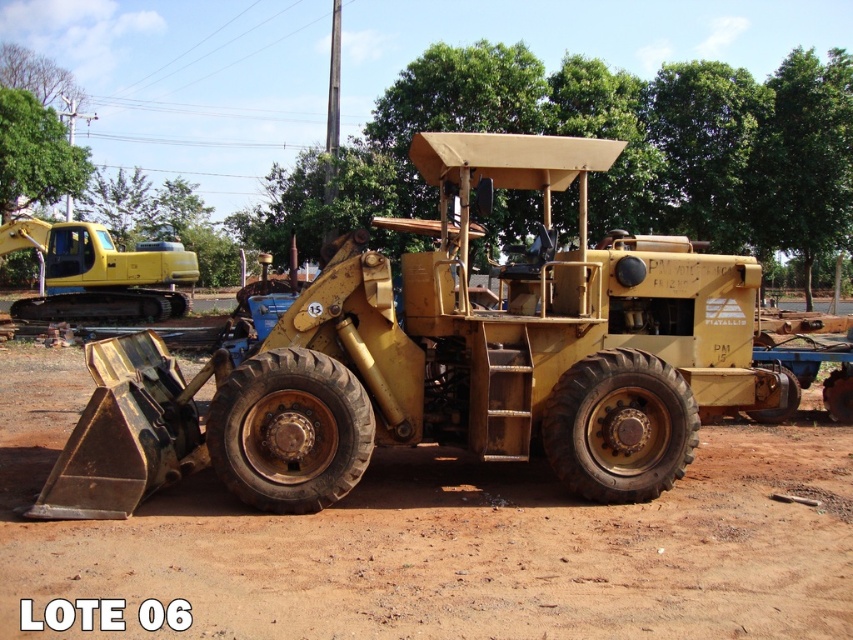
Question: Which of these objects is positioned farthest from the yellow rubber tracked tractor at upper left?

Choices:
 (A) brown dirt field at center
 (B) yellow matte tractor at center

Answer: (B)

Question: Which object is closer to the camera taking this photo?

Choices:
 (A) yellow rubber tracked tractor at upper left
 (B) yellow matte tractor at center
 (C) brown dirt field at center

Answer: (C)

Question: Can you confirm if yellow matte tractor at center is positioned below brown dirt field at center?

Choices:
 (A) no
 (B) yes

Answer: (A)

Question: In this image, where is brown dirt field at center located relative to yellow rubber tracked tractor at upper left?

Choices:
 (A) above
 (B) below

Answer: (B)

Question: Which of the following is the closest to the observer?

Choices:
 (A) (635, 554)
 (B) (331, 452)

Answer: (A)

Question: Observing the image, what is the correct spatial positioning of yellow matte tractor at center in reference to yellow rubber tracked tractor at upper left?

Choices:
 (A) above
 (B) below

Answer: (B)